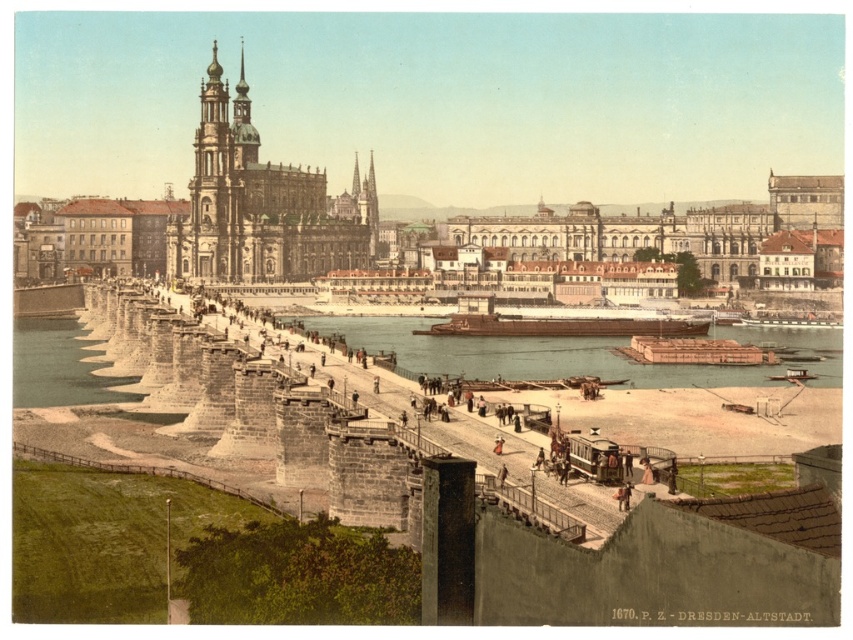
You are a tour guide leading a group on the stone bridge in Dresden. You notice two vessels below you on the river. The first is the brown wooden boats at center, and the second is the brown matte barge at center. Your group wants to know if they can comfortably walk from one vessel to the other using a small plank. The plank is 8 meters long. Can they do this?

The brown wooden boats at center and brown matte barge at center are 8.10 meters apart from each other. Since the plank is only 8 meters long, it would be 10 centimeters short, so they cannot comfortably walk between the two vessels using the plank.

You are standing at the point with coordinates point (465, 321) and want to walk to the point with coordinates point (247, 99). According to the image, will you have to go around any obstacles or can you walk directly towards your destination?

Point (247, 99) is behind point (465, 321), so you will have to go around obstacles to reach your destination since the destination is behind the starting point.